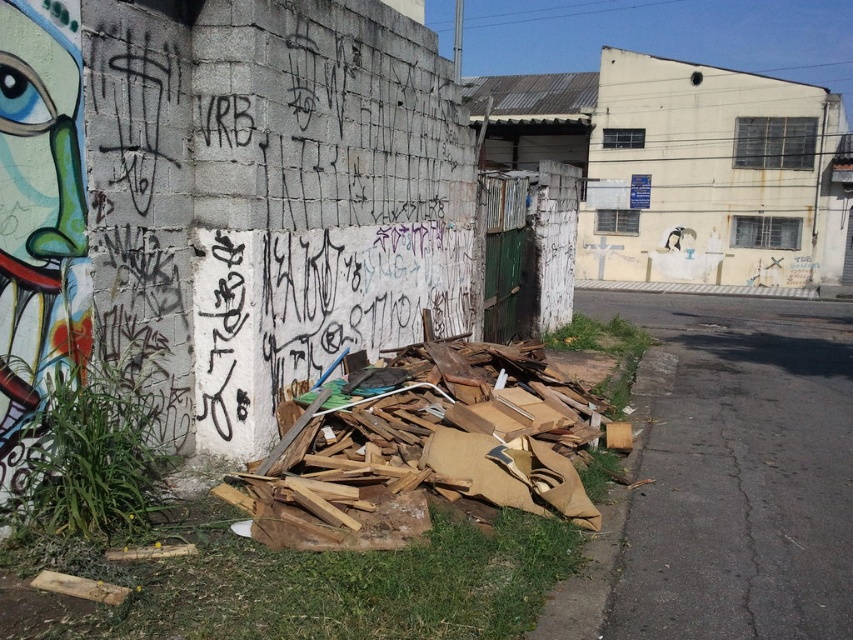
Question: In this image, where is brown cardboard debris at lower right located relative to brown cardboard at lower left?

Choices:
 (A) right
 (B) left

Answer: (A)

Question: Considering the relative positions of brown cardboard debris at lower right and brown cardboard at lower left in the image provided, where is brown cardboard debris at lower right located with respect to brown cardboard at lower left?

Choices:
 (A) above
 (B) below

Answer: (A)

Question: Among these objects, which one is nearest to the camera?

Choices:
 (A) brown cardboard debris at lower right
 (B) brown cardboard at lower left

Answer: (A)

Question: Which of the following is the farthest from the observer?

Choices:
 (A) brown cardboard at lower left
 (B) brown cardboard debris at lower right

Answer: (A)

Question: Is brown cardboard debris at lower right smaller than brown cardboard at lower left?

Choices:
 (A) yes
 (B) no

Answer: (B)

Question: Which point appears closest to the camera in this image?

Choices:
 (A) (439, 406)
 (B) (819, 305)

Answer: (A)